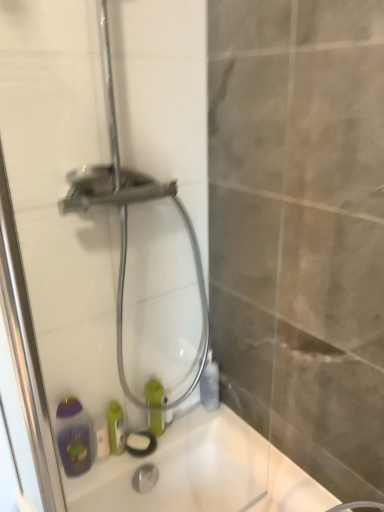
Question: Is matte gray bottle at right, the second bottle when ordered from left to right, shorter than white matte soap bar at lower left?

Choices:
 (A) no
 (B) yes

Answer: (A)

Question: Is matte gray bottle at right, the first bottle viewed from the right, at the right side of white matte soap bar at lower left?

Choices:
 (A) no
 (B) yes

Answer: (B)

Question: From the image's perspective, is matte gray bottle at right, the second bottle when ordered from left to right, beneath white matte soap bar at lower left?

Choices:
 (A) no
 (B) yes

Answer: (A)

Question: Can you see matte gray bottle at right, the second bottle when ordered from left to right, touching white matte soap bar at lower left?

Choices:
 (A) yes
 (B) no

Answer: (B)

Question: Is matte gray bottle at right, the first bottle viewed from the right, oriented towards white matte soap bar at lower left?

Choices:
 (A) no
 (B) yes

Answer: (A)

Question: Is matte gray bottle at right, the second bottle when ordered from left to right, far from white matte soap bar at lower left?

Choices:
 (A) yes
 (B) no

Answer: (B)

Question: Does green matte bottle at center, which is the second bottle in right-to-left order, lie in front of matte gray bottle at right, the second bottle when ordered from left to right?

Choices:
 (A) yes
 (B) no

Answer: (A)

Question: Considering the relative positions of green matte bottle at center, placed as the 1th bottle when sorted from left to right, and matte gray bottle at right, the first bottle viewed from the right, in the image provided, is green matte bottle at center, placed as the 1th bottle when sorted from left to right, to the right of matte gray bottle at right, the first bottle viewed from the right, from the viewer's perspective?

Choices:
 (A) no
 (B) yes

Answer: (A)

Question: Considering the relative sizes of green matte bottle at center, which is the second bottle in right-to-left order, and matte gray bottle at right, the second bottle when ordered from left to right, in the image provided, is green matte bottle at center, which is the second bottle in right-to-left order, bigger than matte gray bottle at right, the second bottle when ordered from left to right,?

Choices:
 (A) no
 (B) yes

Answer: (A)

Question: Is matte gray bottle at right, the second bottle when ordered from left to right, inside green matte bottle at center, placed as the 1th bottle when sorted from left to right?

Choices:
 (A) no
 (B) yes

Answer: (A)

Question: Does green matte bottle at center, placed as the 1th bottle when sorted from left to right, have a lesser width compared to matte gray bottle at right, the first bottle viewed from the right?

Choices:
 (A) no
 (B) yes

Answer: (B)

Question: Considering the relative sizes of green matte bottle at center, which is the second bottle in right-to-left order, and matte gray bottle at right, the second bottle when ordered from left to right, in the image provided, is green matte bottle at center, which is the second bottle in right-to-left order, wider than matte gray bottle at right, the second bottle when ordered from left to right,?

Choices:
 (A) no
 (B) yes

Answer: (A)

Question: Considering the relative sizes of green matte bottle at center, which is the second bottle in right-to-left order, and transparent glass shower door at center in the image provided, is green matte bottle at center, which is the second bottle in right-to-left order, wider than transparent glass shower door at center?

Choices:
 (A) yes
 (B) no

Answer: (A)